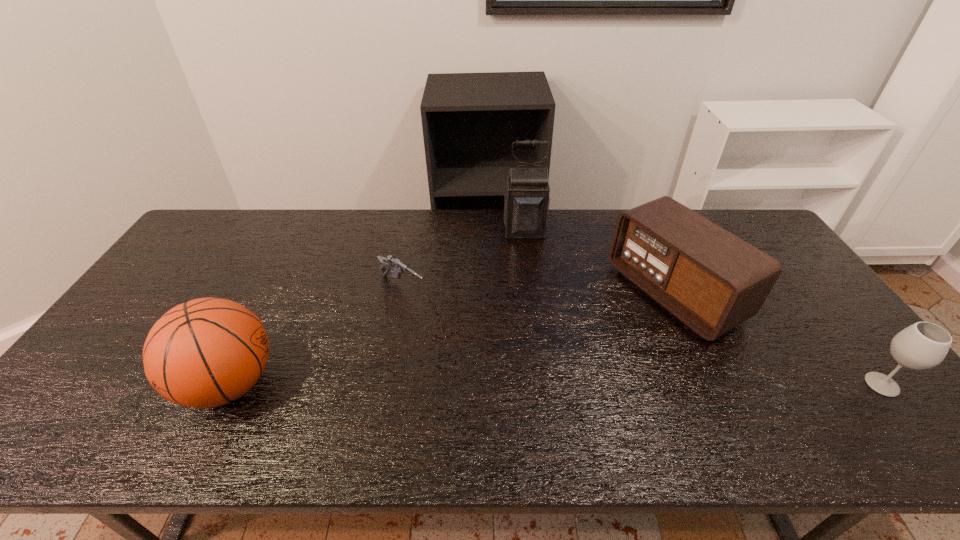
Locate an element on the screen. The width and height of the screenshot is (960, 540). basketball is located at coordinates (204, 353).

At what (x,y) coordinates should I click in order to perform the action: click on wineglass. Please return your answer as a coordinate pair (x, y). Looking at the image, I should click on (923, 345).

At what (x,y) coordinates should I click in order to perform the action: click on the tallest object. Please return your answer as a coordinate pair (x, y). Looking at the image, I should click on (526, 199).

Identify the location of the farthest object. click(x=526, y=199).

The width and height of the screenshot is (960, 540). Identify the location of the fourth object from left to right. (710, 279).

Identify the location of the shortest object. [390, 262].

The width and height of the screenshot is (960, 540). In order to click on the second object from left to right in this screenshot , I will do tap(390, 262).

Find the location of a particular element. This screenshot has width=960, height=540. vacant space located 0.390m on the right of the leftmost object is located at coordinates (440, 384).

Find the location of a particular element. This screenshot has width=960, height=540. free spot located 0.190m on the back of the wineglass is located at coordinates (826, 314).

Identify the location of free region located on the front-facing side of the lantern. This screenshot has height=540, width=960. (530, 276).